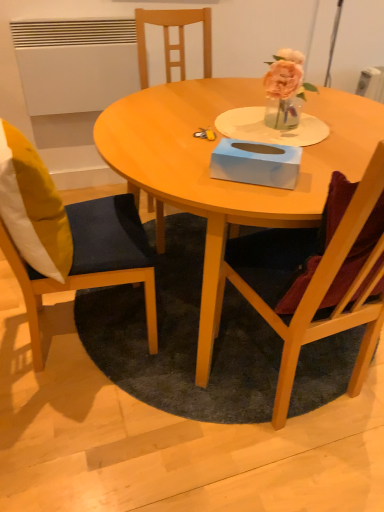
Locate an element on the screen. The image size is (384, 512). vacant area that is in front of wooden chair at left, which is counted as the 2th chair, starting from the right is located at coordinates (70, 429).